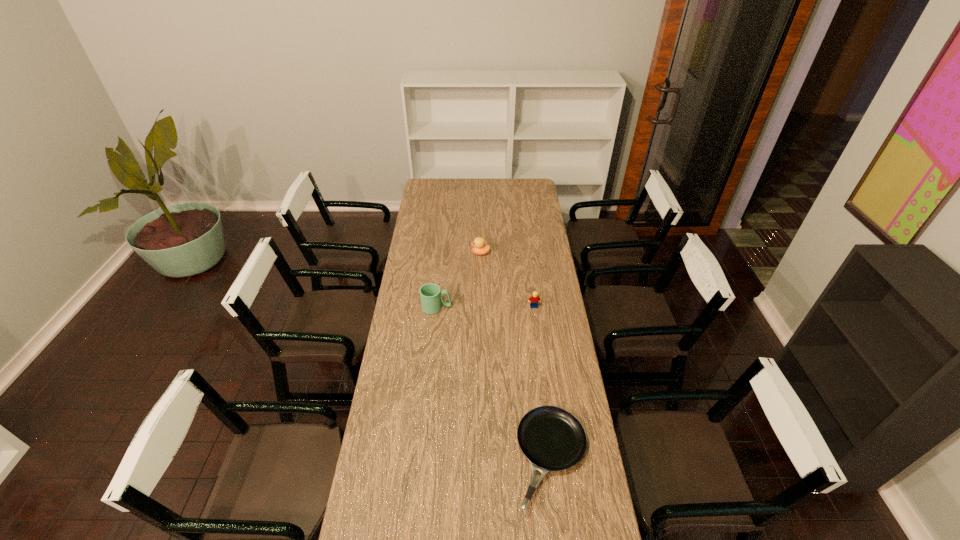
Where is `mug`? This screenshot has height=540, width=960. mug is located at coordinates (431, 297).

The height and width of the screenshot is (540, 960). What are the coordinates of `the tallest object` in the screenshot? It's located at (431, 297).

Find the location of a particular element. the farthest object is located at coordinates (479, 248).

Where is `duckling`? This screenshot has width=960, height=540. duckling is located at coordinates (479, 248).

Where is `Lego`? This screenshot has height=540, width=960. Lego is located at coordinates (535, 299).

At what (x,y) coordinates should I click in order to perform the action: click on the shortest object. Please return your answer as a coordinate pair (x, y). Looking at the image, I should click on (552, 439).

I want to click on pan, so click(552, 439).

Find the location of a particular element. The image size is (960, 540). vacant region located on the side of the leftmost object with the handle is located at coordinates (537, 308).

This screenshot has height=540, width=960. What are the coordinates of `blank area located 0.070m on the face of the duckling` in the screenshot? It's located at (458, 253).

Find the location of `free spot located on the face of the duckling`. free spot located on the face of the duckling is located at coordinates (415, 253).